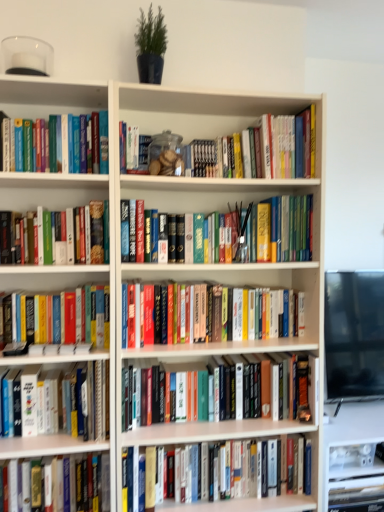
Question: Should I look upward or downward to see green matte plant at upper center?

Choices:
 (A) down
 (B) up

Answer: (B)

Question: Is white matte bookcase at center closer to the viewer compared to hardcover books at center, which is counted as the fifth book, starting from the bottom?

Choices:
 (A) yes
 (B) no

Answer: (A)

Question: Can you confirm if white matte bookcase at center is smaller than hardcover books at center, which is counted as the fifth book, starting from the bottom?

Choices:
 (A) no
 (B) yes

Answer: (A)

Question: From a real-world perspective, is white matte bookcase at center positioned under hardcover books at center, which is the fifth book in top-to-bottom order, based on gravity?

Choices:
 (A) yes
 (B) no

Answer: (A)

Question: Is white matte bookcase at center shorter than hardcover books at center, which is the fifth book in top-to-bottom order?

Choices:
 (A) yes
 (B) no

Answer: (B)

Question: Is white matte bookcase at center bigger than hardcover books at center, which is counted as the fifth book, starting from the bottom?

Choices:
 (A) no
 (B) yes

Answer: (B)

Question: Does white matte bookcase at center come behind hardcover books at center, which is the fifth book in top-to-bottom order?

Choices:
 (A) yes
 (B) no

Answer: (B)

Question: From the image's perspective, is hardcover book at lower left, the 6th book when ordered from top to bottom, on top of hardcover book at center, the 7th book in the top-to-bottom sequence?

Choices:
 (A) no
 (B) yes

Answer: (B)

Question: Considering the relative positions of hardcover book at lower left, the 6th book when ordered from top to bottom, and hardcover book at center, the 7th book in the top-to-bottom sequence, in the image provided, is hardcover book at lower left, the 6th book when ordered from top to bottom, to the right of hardcover book at center, the 7th book in the top-to-bottom sequence, from the viewer's perspective?

Choices:
 (A) yes
 (B) no

Answer: (B)

Question: Is hardcover book at lower left, the fourth book positioned from the bottom, in contact with hardcover book at center, positioned as the third book in bottom-to-top order?

Choices:
 (A) no
 (B) yes

Answer: (A)

Question: Is hardcover book at lower left, the fourth book positioned from the bottom, to the left of hardcover book at center, positioned as the third book in bottom-to-top order, from the viewer's perspective?

Choices:
 (A) yes
 (B) no

Answer: (A)

Question: Considering the relative sizes of hardcover book at lower left, the 6th book when ordered from top to bottom, and hardcover book at center, positioned as the third book in bottom-to-top order, in the image provided, is hardcover book at lower left, the 6th book when ordered from top to bottom, thinner than hardcover book at center, positioned as the third book in bottom-to-top order,?

Choices:
 (A) no
 (B) yes

Answer: (A)

Question: Considering the relative sizes of hardcover book at lower left, the fourth book positioned from the bottom, and hardcover book at center, positioned as the third book in bottom-to-top order, in the image provided, is hardcover book at lower left, the fourth book positioned from the bottom, bigger than hardcover book at center, positioned as the third book in bottom-to-top order,?

Choices:
 (A) yes
 (B) no

Answer: (B)

Question: From the image's perspective, is hardcover book at center, the 7th book in the top-to-bottom sequence, on white matte bookcase at center?

Choices:
 (A) yes
 (B) no

Answer: (B)